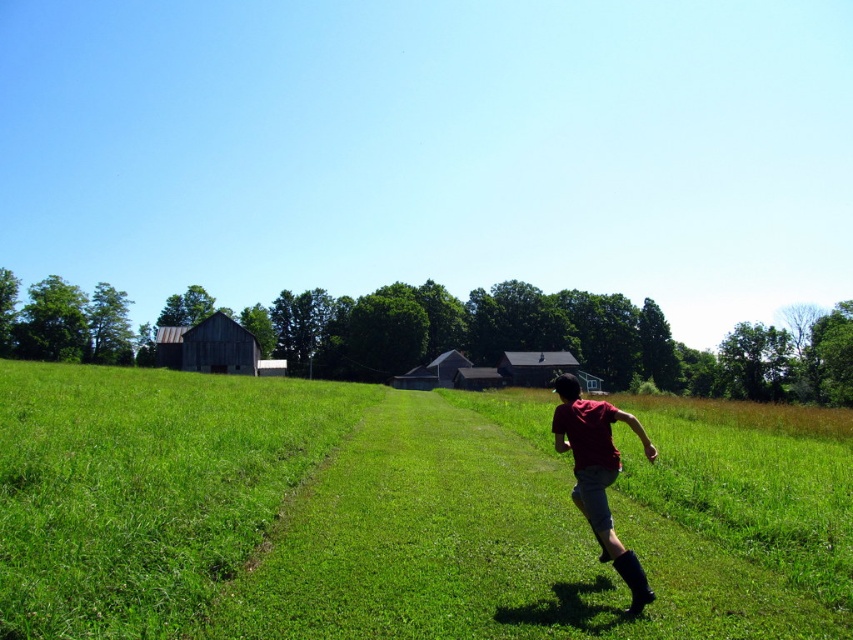
Consider the image. Can you confirm if green grassy field at center is taller than red matte shirt at center?

Yes.

Between green grassy field at center and red matte shirt at center, which one has less height?

red matte shirt at center

Image resolution: width=853 pixels, height=640 pixels. Identify the location of green grassy field at center. [392, 515].